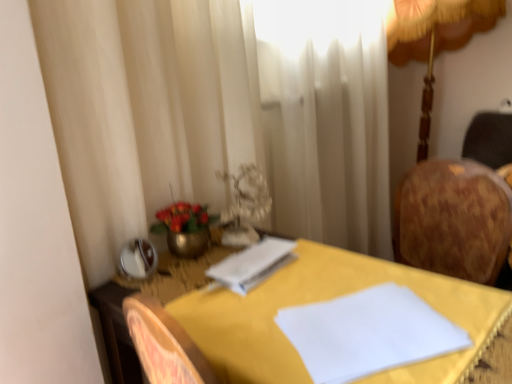
This screenshot has height=384, width=512. Identify the location of vacant area to the right of white paper at center. (324, 269).